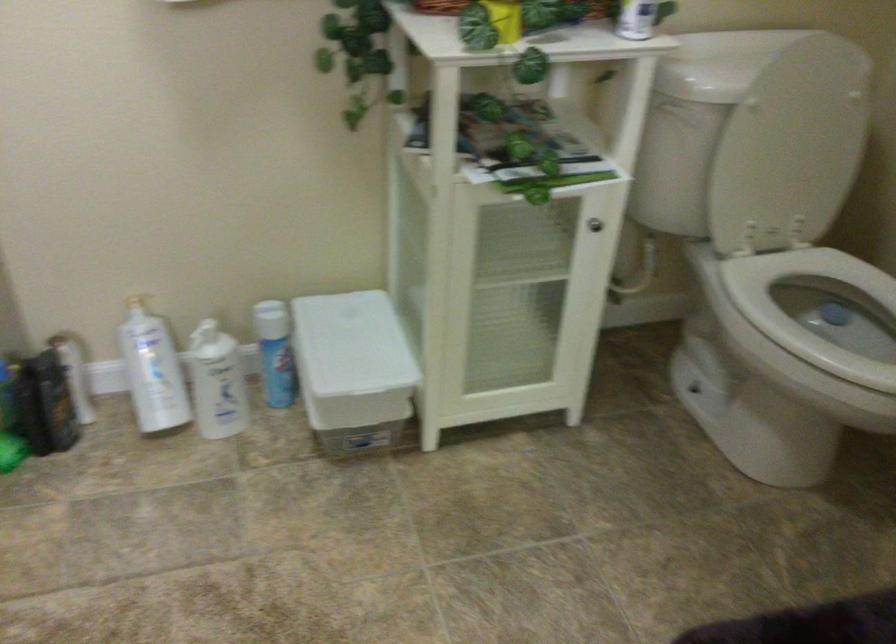
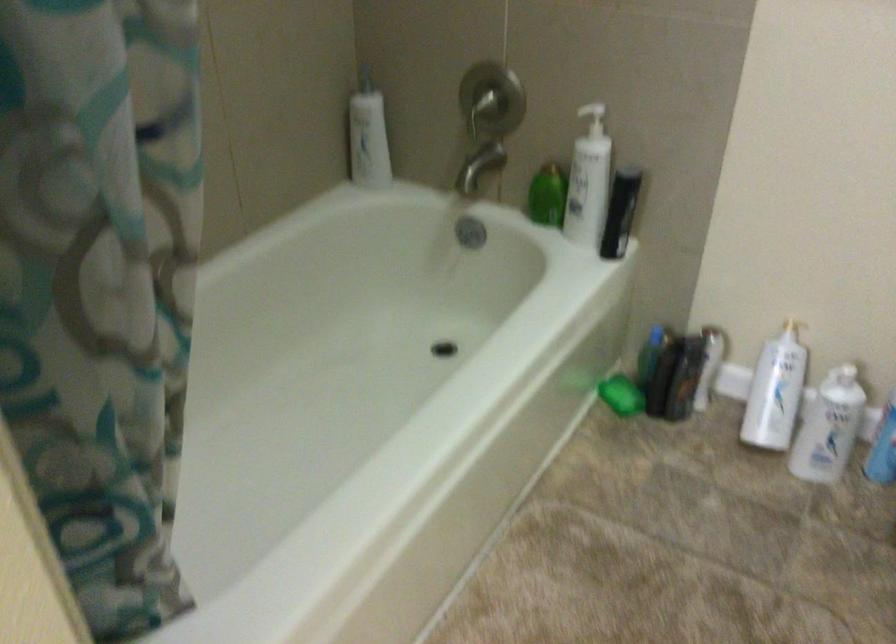
Question: How did the camera likely rotate?

Choices:
 (A) Left
 (B) Right
 (C) Up
 (D) Down

Answer: (A)